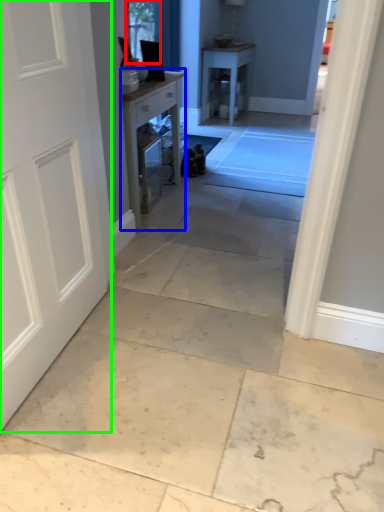
Question: Which object is positioned closest to window screen (highlighted by a red box)? Select from table (highlighted by a blue box) and door (highlighted by a green box).

Choices:
 (A) table
 (B) door

Answer: (A)